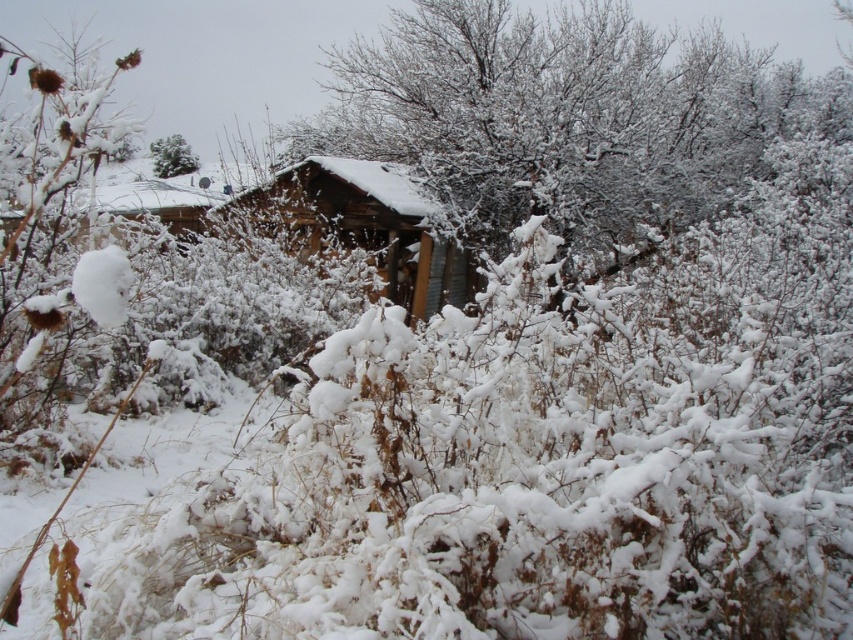
Question: Based on their relative distances, which object is nearer to the snow-covered branches at center?

Choices:
 (A) green matte tree at upper left
 (B) wooden cabin at center

Answer: (B)

Question: Estimate the real-world distances between objects in this image. Which object is closer to the green matte tree at upper left?

Choices:
 (A) snow-covered branches at center
 (B) wooden cabin at center

Answer: (A)

Question: Does wooden cabin at center come in front of green matte tree at upper left?

Choices:
 (A) yes
 (B) no

Answer: (A)

Question: Which object is farther from the camera taking this photo?

Choices:
 (A) snow-covered branches at center
 (B) green matte tree at upper left

Answer: (B)

Question: Does snow-covered branches at center appear on the right side of wooden cabin at center?

Choices:
 (A) yes
 (B) no

Answer: (A)

Question: Can you confirm if snow-covered branches at center is positioned below wooden cabin at center?

Choices:
 (A) yes
 (B) no

Answer: (B)